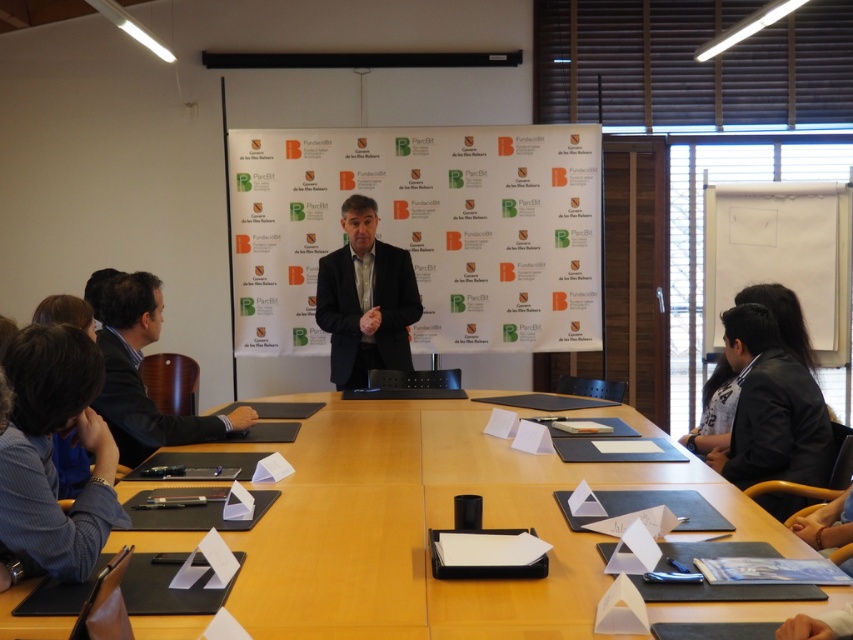
You are a guest at this conference and want to approach the speaker who is at the podium. However, there is a black smooth suit at lower right blocking your path. Can you walk around the matte black podium at center to reach the speaker?

The black smooth suit at lower right is behind the matte black podium at center, so you can walk around the podium to reach the speaker as the suit is not blocking the front path.

In the conference room scene, there are two points marked on the image. The first point is at coordinates point (575,268) and the second is at point (84,557). From the perspective of someone sitting at the table facing the speaker, which point is located behind the other?

Point (575,268) is behind point (84,557).

You are standing at the entrance of the conference room. The entrance is located at point 0.0, 0.0. You want to approach the matte black podium at center to ask a question. What direction should you move in?

Since the matte black podium at center is located at point [422,230], you should move in the positive x and y direction from the entrance at [0,0] to reach it.